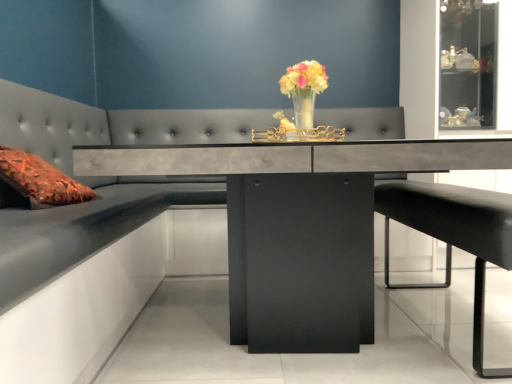
The image size is (512, 384). I want to click on translucent glass vase at center, so click(x=304, y=91).

The height and width of the screenshot is (384, 512). Describe the element at coordinates (304, 91) in the screenshot. I see `translucent glass vase at center` at that location.

Find the location of a particular element. black leather bar stool at lower right is located at coordinates (457, 234).

From the image's perspective, which is below, translucent glass vase at center or concrete gray table at center?

From the image's view, concrete gray table at center is below.

Considering the positions of point (285, 80) and point (349, 279), is point (285, 80) closer or farther from the camera than point (349, 279)?

Point (285, 80).

Is there a large distance between translucent glass vase at center and concrete gray table at center?

They are positioned close to each other.

Between translucent glass vase at center and concrete gray table at center, which one has more height?

concrete gray table at center is taller.

From a real-world perspective, relative to translucent glass vase at center, is black leather bar stool at lower right vertically above or below?

From a real-world perspective, black leather bar stool at lower right is physically below translucent glass vase at center.

Is black leather bar stool at lower right positioned with its back to translucent glass vase at center?

black leather bar stool at lower right does not have its back to translucent glass vase at center.

Does black leather bar stool at lower right come behind translucent glass vase at center?

No, black leather bar stool at lower right is in front of translucent glass vase at center.

Visually, is black leather bar stool at lower right positioned to the left or to the right of translucent glass vase at center?

From the image, it's evident that black leather bar stool at lower right is to the right of translucent glass vase at center.

Is translucent glass vase at center facing away from black leather bar stool at lower right?

No, black leather bar stool at lower right is not at the back of translucent glass vase at center.

From the image's perspective, which one is positioned higher, translucent glass vase at center or black leather bar stool at lower right?

translucent glass vase at center.

From a real-world perspective, which object stands above the other?

translucent glass vase at center, from a real-world perspective.

From a real-world perspective, is concrete gray table at center under translucent glass vase at center?

Correct, in the physical world, concrete gray table at center is lower than translucent glass vase at center.

Would you say translucent glass vase at center is part of concrete gray table at center's contents?

No.

Could you tell me if concrete gray table at center is turned towards translucent glass vase at center?

No, concrete gray table at center is not turned towards translucent glass vase at center.

Is concrete gray table at center oriented towards black leather bar stool at lower right?

Yes, concrete gray table at center faces towards black leather bar stool at lower right.

How many degrees apart are the facing directions of concrete gray table at center and black leather bar stool at lower right?

They differ by 180 degrees in their facing directions.

Considering the positions of objects concrete gray table at center and black leather bar stool at lower right in the image provided, who is more to the right, concrete gray table at center or black leather bar stool at lower right?

black leather bar stool at lower right is more to the right.

Is concrete gray table at center thinner than black leather bar stool at lower right?

No.

From a real-world perspective, is black leather bar stool at lower right on top of concrete gray table at center?

No, from a real-world perspective, black leather bar stool at lower right is not on top of concrete gray table at center.

Is black leather bar stool at lower right looking in the opposite direction of concrete gray table at center?

black leather bar stool at lower right does not have its back to concrete gray table at center.

Which is less distant, [495,257] or [282,228]?

Point [495,257] appears to be closer to the viewer than point [282,228].

Is black leather bar stool at lower right inside the boundaries of concrete gray table at center, or outside?

black leather bar stool at lower right exists entirely within concrete gray table at center.

Find the location of a particular element. The width and height of the screenshot is (512, 384). floral arrangement positioned vertically above the concrete gray table at center (from a real-world perspective) is located at coordinates [x=304, y=91].

Locate an element on the screen. The image size is (512, 384). bar stool in front of the translucent glass vase at center is located at coordinates (457, 234).

When comparing their distances from black leather bar stool at lower right, does translucent glass vase at center or concrete gray table at center seem further?

Based on the image, translucent glass vase at center appears to be further to black leather bar stool at lower right.

Based on their spatial positions, is black leather bar stool at lower right or translucent glass vase at center closer to concrete gray table at center?

Based on the image, translucent glass vase at center appears to be nearer to concrete gray table at center.

Based on the photo, from the image, which object appears to be farther from black leather bar stool at lower right, concrete gray table at center or translucent glass vase at center?

translucent glass vase at center lies further to black leather bar stool at lower right than the other object.

Estimate the real-world distances between objects in this image. Which object is closer to concrete gray table at center, translucent glass vase at center or black leather bar stool at lower right?

translucent glass vase at center is positioned closer to the anchor concrete gray table at center.

From the image, which object appears to be farther from translucent glass vase at center, concrete gray table at center or black leather bar stool at lower right?

black leather bar stool at lower right.

Which object lies nearer to the anchor point translucent glass vase at center, black leather bar stool at lower right or concrete gray table at center?

concrete gray table at center.

You are a GUI agent. You are given a task and a screenshot of the screen. Output one action in this format:
    pyautogui.click(x=<x>, y=<y>)
    Task: Click on the floral arrangement between concrete gray table at center and black leather bar stool at lower right
    This screenshot has width=512, height=384.
    Given the screenshot: What is the action you would take?
    pyautogui.click(x=304, y=91)